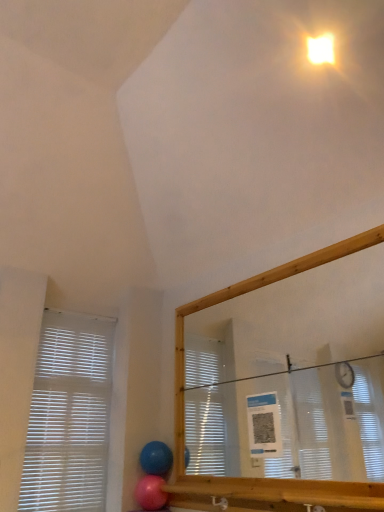
Question: In the image, is white plastic blinds at left positioned in front of or behind bright yellow plastic light at upper right?

Choices:
 (A) front
 (B) behind

Answer: (B)

Question: Considering the positions of white plastic blinds at left and bright yellow plastic light at upper right in the image, is white plastic blinds at left bigger or smaller than bright yellow plastic light at upper right?

Choices:
 (A) small
 (B) big

Answer: (B)

Question: Which is nearer to the blue rubber balloon at lower center, the first balloon from the top?

Choices:
 (A) white plastic blinds at left
 (B) pink rubber balloon at lower center, acting as the 2th balloon starting from the top
 (C) bright yellow plastic light at upper right

Answer: (B)

Question: Which object is positioned closest to the white plastic blinds at left?

Choices:
 (A) blue rubber balloon at lower center, the second balloon from the bottom
 (B) bright yellow plastic light at upper right
 (C) pink rubber balloon at lower center, positioned as the first balloon in bottom-to-top order

Answer: (A)